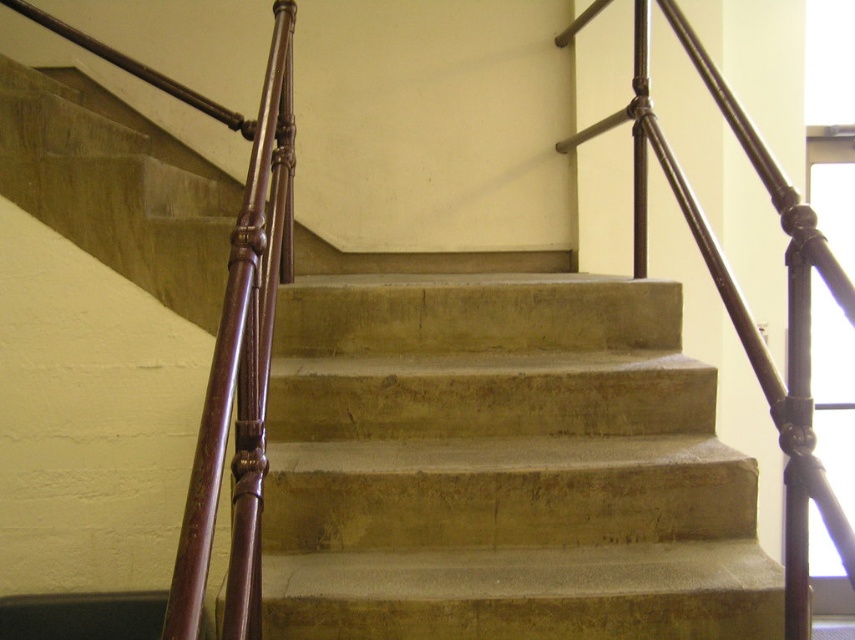
Question: In this image, where is concrete stairs at center located relative to polished dark brown metal railing at upper right?

Choices:
 (A) above
 (B) below

Answer: (B)

Question: Among these objects, which one is farthest from the camera?

Choices:
 (A) polished dark brown metal railing at upper right
 (B) concrete stairs at center

Answer: (B)

Question: Is concrete stairs at center positioned before polished dark brown metal railing at upper right?

Choices:
 (A) yes
 (B) no

Answer: (B)

Question: Is concrete stairs at center further to the viewer compared to polished dark brown metal railing at upper right?

Choices:
 (A) no
 (B) yes

Answer: (B)